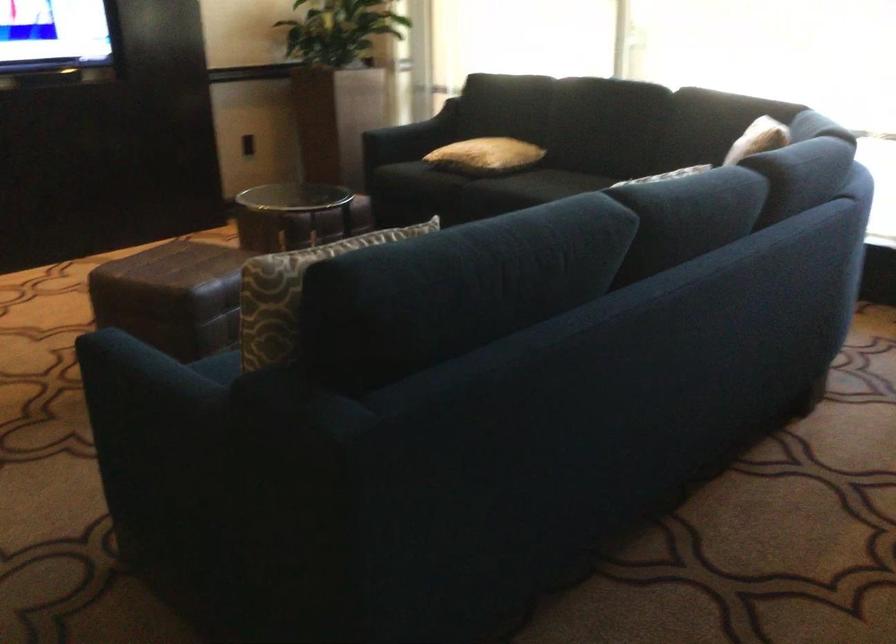
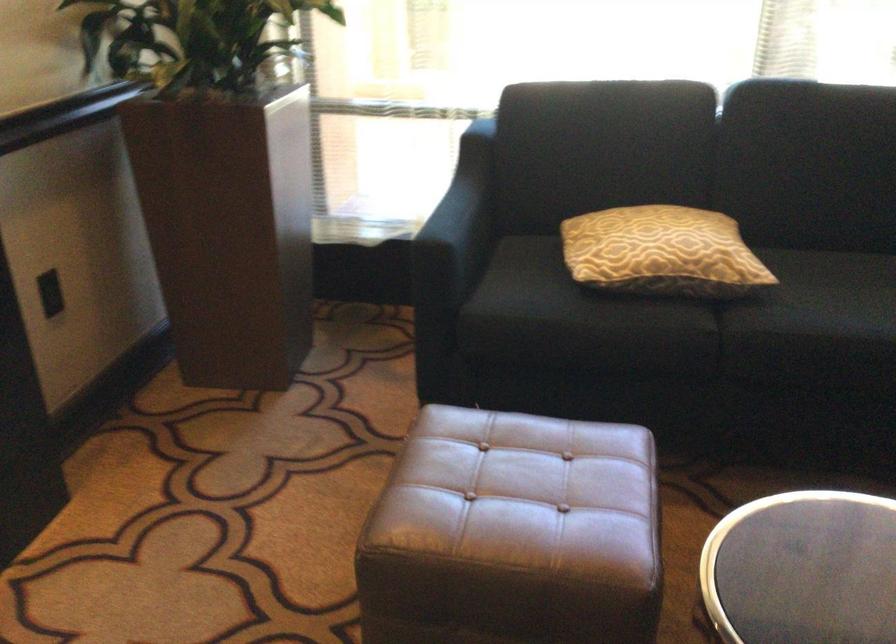
Locate, in the second image, the point that corresponds to point 462,149 in the first image.

(661, 252)